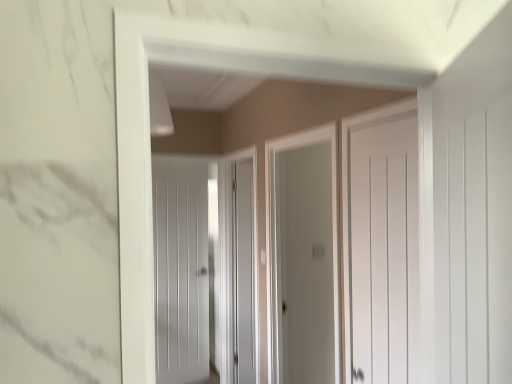
Question: Which direction should I rotate to face white matte door at center, the second door positioned from the right, — up or down?

Choices:
 (A) up
 (B) down

Answer: (B)

Question: Is the position of matte gray screen door at center, which appears as the 1th screen door when viewed from the left, more distant than that of white matte door at center, marked as the first door in a right-to-left arrangement?

Choices:
 (A) yes
 (B) no

Answer: (A)

Question: Can you confirm if matte gray screen door at center, which appears as the 1th screen door when viewed from the left, is positioned to the right of white matte door at center, placed as the 2th door when sorted from back to front?

Choices:
 (A) no
 (B) yes

Answer: (A)

Question: Considering the relative sizes of matte gray screen door at center, marked as the 2th screen door in a right-to-left arrangement, and white matte door at center, placed as the 2th door when sorted from back to front, in the image provided, is matte gray screen door at center, marked as the 2th screen door in a right-to-left arrangement, wider than white matte door at center, placed as the 2th door when sorted from back to front,?

Choices:
 (A) yes
 (B) no

Answer: (A)

Question: Is matte gray screen door at center, marked as the 2th screen door in a right-to-left arrangement, placed right next to white matte door at center, acting as the second door starting from the left?

Choices:
 (A) yes
 (B) no

Answer: (B)

Question: Is matte gray screen door at center, marked as the 2th screen door in a right-to-left arrangement, facing towards white matte door at center, placed as the 2th door when sorted from back to front?

Choices:
 (A) no
 (B) yes

Answer: (A)

Question: Is matte gray screen door at center, arranged as the 2th screen door when viewed from the front, positioned far away from white matte door at center, which is the 1th door in front-to-back order?

Choices:
 (A) yes
 (B) no

Answer: (A)

Question: Considering the relative sizes of matte gray screen door at center, placed as the first screen door when sorted from back to front, and white matte door at center, the second door positioned from the right, in the image provided, is matte gray screen door at center, placed as the first screen door when sorted from back to front, taller than white matte door at center, the second door positioned from the right,?

Choices:
 (A) yes
 (B) no

Answer: (B)

Question: Is matte gray screen door at center, placed as the first screen door when sorted from back to front, wider than white matte door at center, placed as the first door when sorted from back to front?

Choices:
 (A) yes
 (B) no

Answer: (A)

Question: From a real-world perspective, is matte gray screen door at center, which appears as the 1th screen door when viewed from the left, over white matte door at center, arranged as the second door when viewed from the front?

Choices:
 (A) no
 (B) yes

Answer: (B)

Question: From a real-world perspective, is matte gray screen door at center, marked as the 2th screen door in a right-to-left arrangement, below white matte door at center, the 1th door from the left?

Choices:
 (A) no
 (B) yes

Answer: (A)

Question: Is matte gray screen door at center, arranged as the 2th screen door when viewed from the front, completely or partially outside of white matte door at center, placed as the first door when sorted from back to front?

Choices:
 (A) yes
 (B) no

Answer: (A)

Question: From the image's perspective, would you say matte gray screen door at center, placed as the first screen door when sorted from back to front, is shown under white matte door at center, the 1th door from the left?

Choices:
 (A) no
 (B) yes

Answer: (A)

Question: Is white matte door at center, placed as the 2th door when sorted from back to front, aimed at matte gray screen door at center, marked as the 2th screen door in a right-to-left arrangement?

Choices:
 (A) no
 (B) yes

Answer: (A)